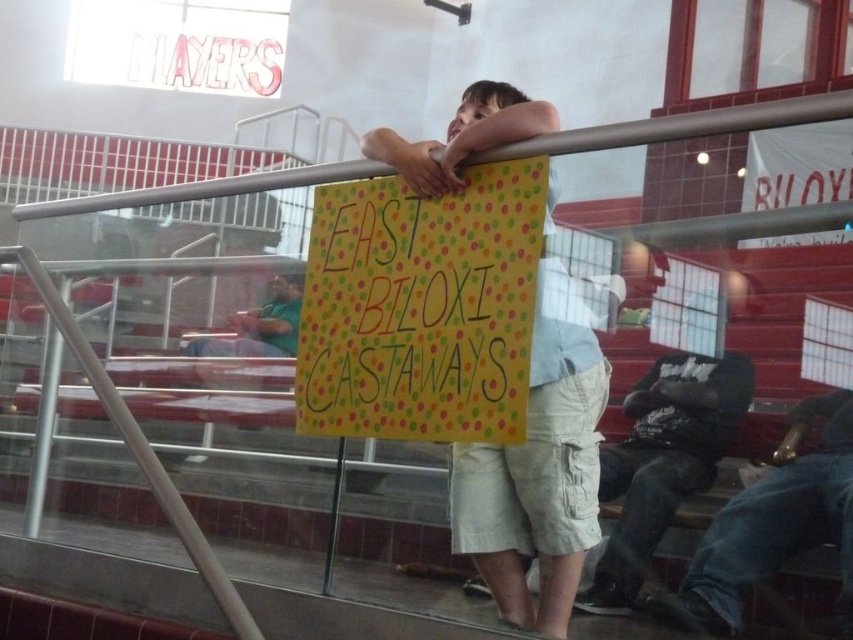
Can you confirm if light beige shorts at center is positioned to the right of green fabric shirt at left?

Yes, light beige shorts at center is to the right of green fabric shirt at left.

Is light beige shorts at center above green fabric shirt at left?

Yes.

Is point (524, 442) less distant than point (260, 339)?

Yes.

Image resolution: width=853 pixels, height=640 pixels. Find the location of `light beige shorts at center`. light beige shorts at center is located at coordinates (537, 481).

Between point (500, 176) and point (654, 502), which one is positioned behind?

The point (654, 502) is more distant.

Which is more to the left, polka dot paper sign at center or dark gray hoodie at lower right?

Positioned to the left is polka dot paper sign at center.

Where is `polka dot paper sign at center`? This screenshot has height=640, width=853. polka dot paper sign at center is located at coordinates (421, 307).

You are a GUI agent. You are given a task and a screenshot of the screen. Output one action in this format:
    pyautogui.click(x=<x>, y=<y>)
    Task: Click on the polka dot paper sign at center
    
    Given the screenshot: What is the action you would take?
    pyautogui.click(x=421, y=307)

Can you confirm if denim pants at lower right is wider than green fabric shirt at left?

Incorrect, denim pants at lower right's width does not surpass green fabric shirt at left's.

What do you see at coordinates (775, 525) in the screenshot?
I see `denim pants at lower right` at bounding box center [775, 525].

The width and height of the screenshot is (853, 640). What do you see at coordinates (775, 525) in the screenshot?
I see `denim pants at lower right` at bounding box center [775, 525].

The height and width of the screenshot is (640, 853). What are the coordinates of `denim pants at lower right` in the screenshot? It's located at (775, 525).